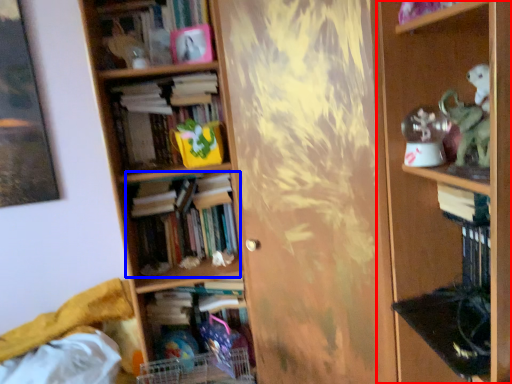
Question: Which point is further to the camera, shelf (highlighted by a red box) or book (highlighted by a blue box)?

Choices:
 (A) shelf
 (B) book

Answer: (B)